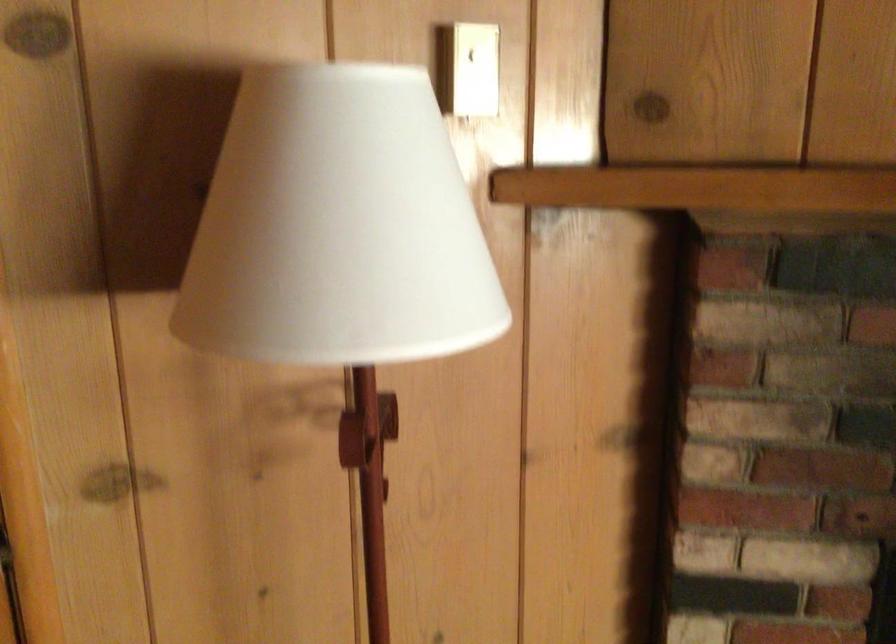
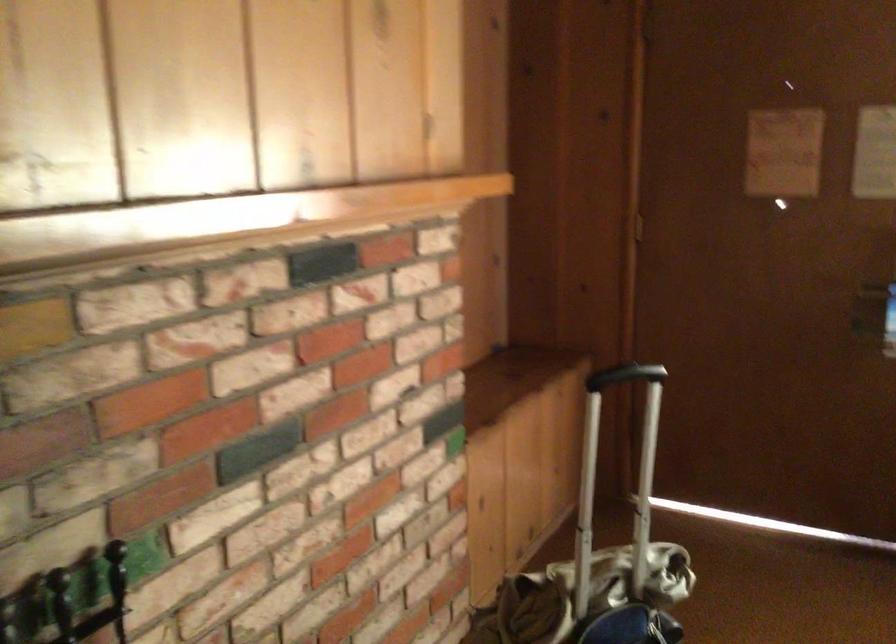
Question: Based on the continuous images, in which direction is the camera rotating? Reply with the corresponding letter.

Choices:
 (A) Left
 (B) Right
 (C) Up
 (D) Down

Answer: (B)